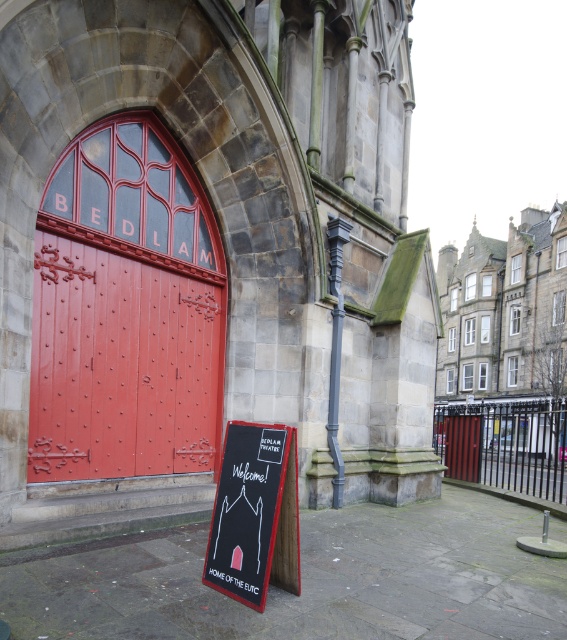
Is stone church at center to the right of smooth red wooden door at center from the viewer's perspective?

Yes, stone church at center is to the right of smooth red wooden door at center.

Is stone church at center bigger than smooth red wooden door at center?

Yes.

Identify the location of stone church at center. This screenshot has height=640, width=567. pos(205,253).

Which of these two, black cardboard sign at center or wooden door at center, stands shorter?

black cardboard sign at center

Can you confirm if black cardboard sign at center is positioned to the right of wooden door at center?

In fact, black cardboard sign at center is to the left of wooden door at center.

Is point (264, 580) in front of point (466, 472)?

Yes, point (264, 580) is in front of point (466, 472).

The width and height of the screenshot is (567, 640). Identify the location of black cardboard sign at center. (255, 515).

Can you confirm if smooth red wooden door at center is positioned to the right of wooden door at center?

Incorrect, smooth red wooden door at center is not on the right side of wooden door at center.

Which is behind, point (113, 410) or point (467, 417)?

The point (467, 417) is behind.

This screenshot has height=640, width=567. What do you see at coordinates (121, 365) in the screenshot?
I see `smooth red wooden door at center` at bounding box center [121, 365].

Where is `smooth red wooden door at center`? Image resolution: width=567 pixels, height=640 pixels. smooth red wooden door at center is located at coordinates [121, 365].